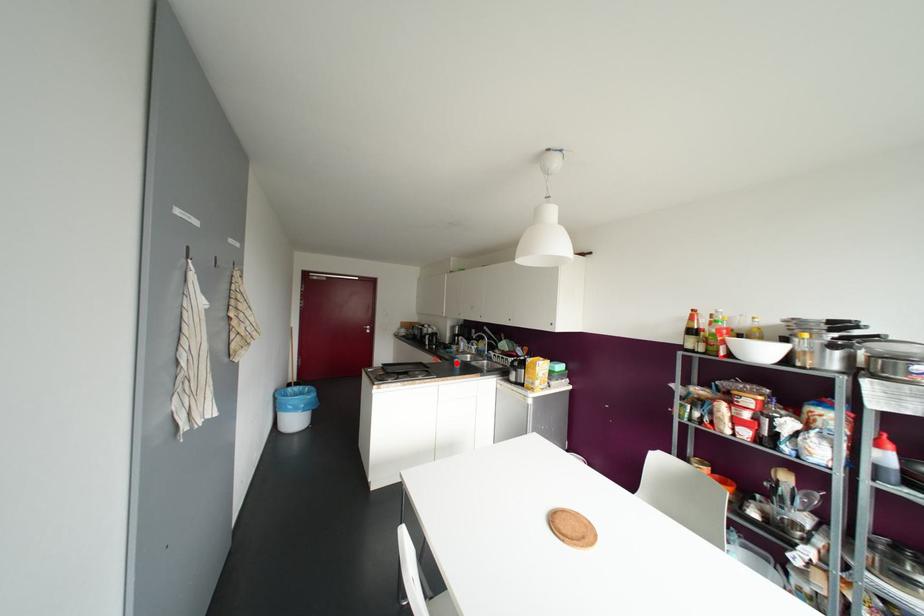
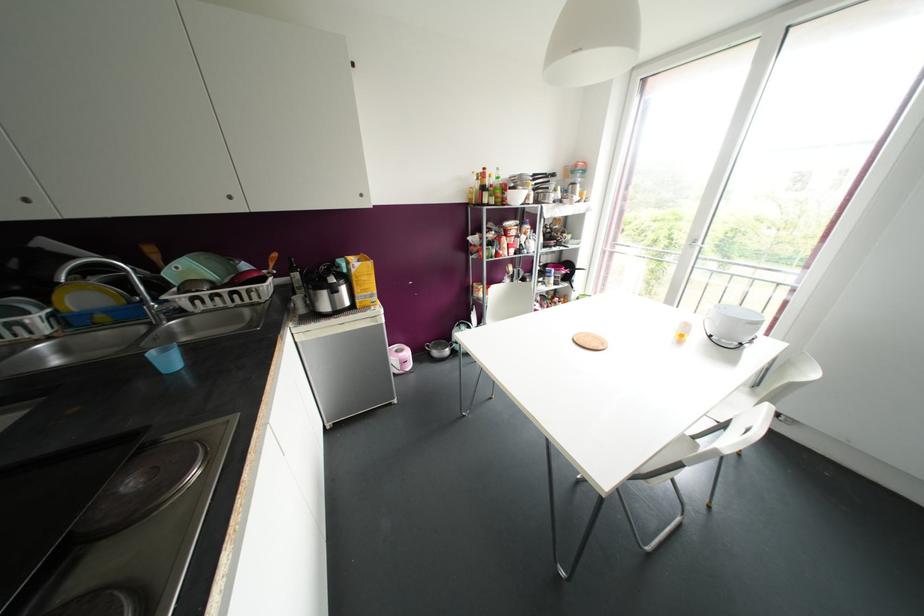
Find the pixel in the second image that matches the highlighted location in the first image.

(168, 361)